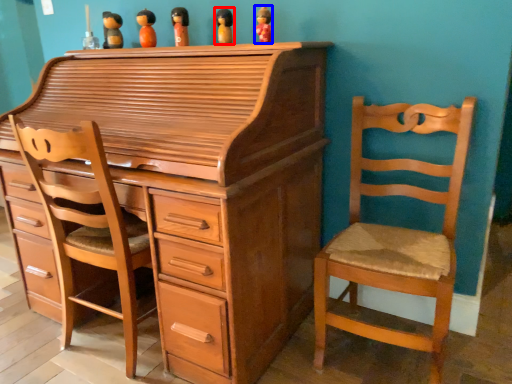
Question: Which object appears closest to the camera in this image, toy (highlighted by a red box) or toy (highlighted by a blue box)?

Choices:
 (A) toy
 (B) toy

Answer: (B)